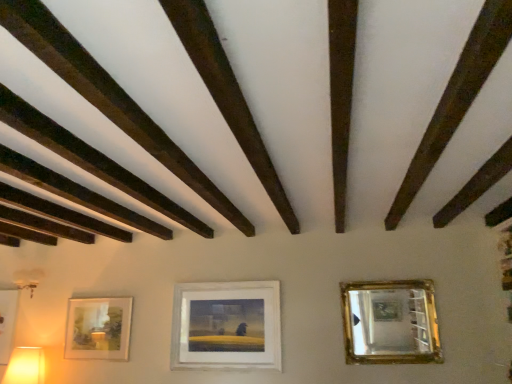
The height and width of the screenshot is (384, 512). Describe the element at coordinates (25, 366) in the screenshot. I see `matte yellow plastic table lamp at lower left` at that location.

This screenshot has height=384, width=512. Describe the element at coordinates (389, 322) in the screenshot. I see `gold-framed mirror at upper right` at that location.

How much space does matte white picture frame at center, arranged as the third picture frame when viewed from the left, occupy horizontally?

2.82 inches.

Locate an element on the screen. matte white picture frame at center, arranged as the first picture frame when viewed from the right is located at coordinates (226, 325).

Where is `matte yellow plastic table lamp at lower left`? This screenshot has height=384, width=512. matte yellow plastic table lamp at lower left is located at coordinates (25, 366).

Considering the sizes of matte white picture frame at lower left, acting as the third picture frame starting from the right, and dark brown wood at upper left in the image, is matte white picture frame at lower left, acting as the third picture frame starting from the right, bigger or smaller than dark brown wood at upper left?

Considering their sizes, matte white picture frame at lower left, acting as the third picture frame starting from the right, takes up less space than dark brown wood at upper left.

Considering the relative sizes of matte white picture frame at lower left, placed as the 1th picture frame when sorted from left to right, and dark brown wood at upper left in the image provided, is matte white picture frame at lower left, placed as the 1th picture frame when sorted from left to right, thinner than dark brown wood at upper left?

Correct, the width of matte white picture frame at lower left, placed as the 1th picture frame when sorted from left to right, is less than that of dark brown wood at upper left.

Is matte white picture frame at lower left, acting as the third picture frame starting from the right, to the left of dark brown wood at upper left from the viewer's perspective?

Yes.

Which is more distant, (11,26) or (12,291)?

The point (12,291) is behind.

Considering the relative sizes of dark brown wood at upper left and matte white picture frame at lower left, placed as the 1th picture frame when sorted from left to right, in the image provided, is dark brown wood at upper left shorter than matte white picture frame at lower left, placed as the 1th picture frame when sorted from left to right,?

Indeed, dark brown wood at upper left has a lesser height compared to matte white picture frame at lower left, placed as the 1th picture frame when sorted from left to right.

Choose the correct answer: Is dark brown wood at upper left inside matte white picture frame at lower left, placed as the 1th picture frame when sorted from left to right, or outside it?

dark brown wood at upper left is not enclosed by matte white picture frame at lower left, placed as the 1th picture frame when sorted from left to right.

From the image's perspective, is dark brown wood at upper left located above matte white picture frame at lower left, acting as the third picture frame starting from the right?

Correct, dark brown wood at upper left appears higher than matte white picture frame at lower left, acting as the third picture frame starting from the right, in the image.

Does matte white picture frame at center, arranged as the first picture frame when viewed from the right, touch matte white picture frame at lower left, which is the 2th picture frame in left-to-right order?

matte white picture frame at center, arranged as the first picture frame when viewed from the right, and matte white picture frame at lower left, which is the 2th picture frame in left-to-right order, are not in contact.

Which of these two, matte white picture frame at center, arranged as the first picture frame when viewed from the right, or matte white picture frame at lower left, the 2th picture frame positioned from the right, is thinner?

matte white picture frame at lower left, the 2th picture frame positioned from the right.

From the image's perspective, is matte white picture frame at center, arranged as the first picture frame when viewed from the right, positioned above or below matte white picture frame at lower left, which is the 2th picture frame in left-to-right order?

matte white picture frame at center, arranged as the first picture frame when viewed from the right, is above matte white picture frame at lower left, which is the 2th picture frame in left-to-right order.

From a real-world perspective, who is located lower, matte yellow plastic table lamp at lower left or dark brown wood at upper left?

matte yellow plastic table lamp at lower left, from a real-world perspective.

Is matte yellow plastic table lamp at lower left looking in the opposite direction of dark brown wood at upper left?

matte yellow plastic table lamp at lower left does not have its back to dark brown wood at upper left.

Considering the sizes of matte yellow plastic table lamp at lower left and dark brown wood at upper left in the image, is matte yellow plastic table lamp at lower left taller or shorter than dark brown wood at upper left?

Considering their sizes, matte yellow plastic table lamp at lower left has more height than dark brown wood at upper left.

Relative to dark brown wood at upper left, is matte yellow plastic table lamp at lower left in front or behind?

Visually, matte yellow plastic table lamp at lower left is located behind dark brown wood at upper left.

You are a GUI agent. You are given a task and a screenshot of the screen. Output one action in this format:
    pyautogui.click(x=<x>, y=<y>)
    Task: Click on the plank on the left of the matte white picture frame at center, arranged as the first picture frame when viewed from the right
    
    Given the screenshot: What is the action you would take?
    pyautogui.click(x=108, y=97)

Does matte white picture frame at center, arranged as the third picture frame when viewed from the left, have a smaller size compared to dark brown wood at upper left?

Actually, matte white picture frame at center, arranged as the third picture frame when viewed from the left, might be larger than dark brown wood at upper left.

Looking at this image, which of these two, matte white picture frame at center, arranged as the first picture frame when viewed from the right, or dark brown wood at upper left, stands shorter?

Standing shorter between the two is dark brown wood at upper left.

Is matte white picture frame at center, arranged as the third picture frame when viewed from the left, not inside dark brown wood at upper left?

Yes, matte white picture frame at center, arranged as the third picture frame when viewed from the left, is located beyond the bounds of dark brown wood at upper left.

Is matte white picture frame at center, arranged as the third picture frame when viewed from the left, taller or shorter than matte white picture frame at lower left, placed as the 1th picture frame when sorted from left to right?

In the image, matte white picture frame at center, arranged as the third picture frame when viewed from the left, appears to be taller than matte white picture frame at lower left, placed as the 1th picture frame when sorted from left to right.

The height and width of the screenshot is (384, 512). Find the location of `picture frame that is the 2nd object located behind the matte white picture frame at center, arranged as the third picture frame when viewed from the left`. picture frame that is the 2nd object located behind the matte white picture frame at center, arranged as the third picture frame when viewed from the left is located at coordinates (7, 322).

Between matte white picture frame at center, arranged as the third picture frame when viewed from the left, and matte white picture frame at lower left, placed as the 1th picture frame when sorted from left to right, which one has smaller size?

matte white picture frame at lower left, placed as the 1th picture frame when sorted from left to right, is smaller.

In terms of width, does matte white picture frame at center, arranged as the third picture frame when viewed from the left, look wider or thinner when compared to matte white picture frame at lower left, acting as the third picture frame starting from the right?

In the image, matte white picture frame at center, arranged as the third picture frame when viewed from the left, appears to be wider than matte white picture frame at lower left, acting as the third picture frame starting from the right.

How many degrees apart are the facing directions of matte white picture frame at center, arranged as the first picture frame when viewed from the right, and gold-framed mirror at upper right?

0.161 degrees.

From the image's perspective, which one is positioned higher, matte white picture frame at center, arranged as the first picture frame when viewed from the right, or gold-framed mirror at upper right?

From the image's view, gold-framed mirror at upper right is above.

From a real-world perspective, between matte white picture frame at center, arranged as the third picture frame when viewed from the left, and gold-framed mirror at upper right, who is vertically lower?

In real-world perspective, matte white picture frame at center, arranged as the third picture frame when viewed from the left, is lower.

This screenshot has width=512, height=384. In order to click on plank that is on the right side of matte white picture frame at lower left, acting as the third picture frame starting from the right in this screenshot , I will do `click(108, 97)`.

In order to click on the 3rd picture frame behind the dark brown wood at upper left, starting your count from the anchor in this screenshot , I will do `click(7, 322)`.

Looking at this image, considering their positions, is matte yellow plastic table lamp at lower left positioned further to dark brown wood at upper left than gold-framed mirror at upper right?

matte yellow plastic table lamp at lower left.

Looking at the image, which one is located closer to matte white picture frame at lower left, which is the 2th picture frame in left-to-right order, dark brown wood at upper left or matte white picture frame at lower left, placed as the 1th picture frame when sorted from left to right?

Based on the image, matte white picture frame at lower left, placed as the 1th picture frame when sorted from left to right, appears to be nearer to matte white picture frame at lower left, which is the 2th picture frame in left-to-right order.

From the picture: From the image, which object appears to be nearer to matte white picture frame at center, arranged as the first picture frame when viewed from the right, matte white picture frame at lower left, placed as the 1th picture frame when sorted from left to right, or gold-framed mirror at upper right?

Among the two, gold-framed mirror at upper right is located nearer to matte white picture frame at center, arranged as the first picture frame when viewed from the right.

Estimate the real-world distances between objects in this image. Which object is further from dark brown wood at upper left, matte white picture frame at center, arranged as the first picture frame when viewed from the right, or matte white picture frame at lower left, the 2th picture frame positioned from the right?

matte white picture frame at lower left, the 2th picture frame positioned from the right, is positioned further to the anchor dark brown wood at upper left.

Which object lies further to the anchor point matte white picture frame at center, arranged as the first picture frame when viewed from the right, gold-framed mirror at upper right or matte yellow plastic table lamp at lower left?

matte yellow plastic table lamp at lower left is further to matte white picture frame at center, arranged as the first picture frame when viewed from the right.

Estimate the real-world distances between objects in this image. Which object is closer to matte white picture frame at lower left, acting as the third picture frame starting from the right, dark brown wood at upper left or gold-framed mirror at upper right?

→ dark brown wood at upper left is closer to matte white picture frame at lower left, acting as the third picture frame starting from the right.

From the image, which object appears to be farther from dark brown wood at upper left, matte white picture frame at lower left, the 2th picture frame positioned from the right, or matte yellow plastic table lamp at lower left?

matte yellow plastic table lamp at lower left is positioned further to the anchor dark brown wood at upper left.

Estimate the real-world distances between objects in this image. Which object is closer to gold-framed mirror at upper right, matte yellow plastic table lamp at lower left or matte white picture frame at lower left, acting as the third picture frame starting from the right?

Among the two, matte yellow plastic table lamp at lower left is located nearer to gold-framed mirror at upper right.

Locate an element on the screen. plank located between matte white picture frame at lower left, placed as the 1th picture frame when sorted from left to right, and gold-framed mirror at upper right in the left-right direction is located at coordinates (108, 97).

Locate an element on the screen. The height and width of the screenshot is (384, 512). table lamp between matte white picture frame at lower left, placed as the 1th picture frame when sorted from left to right, and matte white picture frame at center, arranged as the third picture frame when viewed from the left, from left to right is located at coordinates (25, 366).

In order to click on mirror positioned between dark brown wood at upper left and matte white picture frame at center, arranged as the first picture frame when viewed from the right, from near to far in this screenshot , I will do `click(389, 322)`.

At what (x,y) coordinates should I click in order to perform the action: click on table lamp between matte white picture frame at lower left, acting as the third picture frame starting from the right, and gold-framed mirror at upper right. Please return your answer as a coordinate pair (x, y). The image size is (512, 384). Looking at the image, I should click on (25, 366).